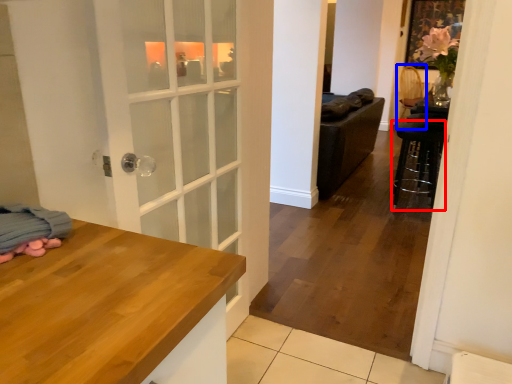
Question: Which object is closer to the camera taking this photo, bar stool (highlighted by a red box) or armchair (highlighted by a blue box)?

Choices:
 (A) bar stool
 (B) armchair

Answer: (A)